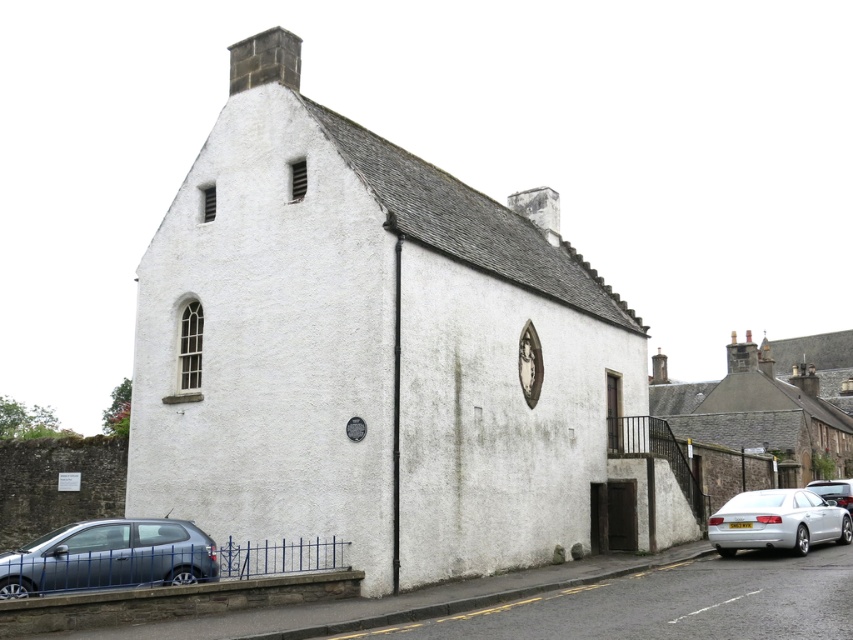
You are standing in front of the building and notice two silver vehicles at the lower right corner. Which one is positioned to the left between the silver metallic sedan at lower right and the silver metallic car at lower right?

The silver metallic sedan at lower right is positioned to the left of the silver metallic car at lower right.

Based on the photo, you are a delivery person trying to park a truck that is 2 meters tall. You see the silver metallic sedan at lower right and the silver metallic car at lower right in the parking area. Which vehicle should you park next to so that your truck can fit between them without hitting the roof?

The silver metallic sedan at lower right has a greater height compared to silver metallic car at lower right. Therefore, you should park the truck next to the silver metallic car at lower lower right since it is shorter, allowing more clearance for the truck.

You are a delivery person driving a van that is 2 meters wide. You need to park your van between the metallic gray hatchback at lower left and the silver metallic sedan at lower right. Is there enough space between them for your van?

The metallic gray hatchback at lower left has a lesser width compared to silver metallic sedan at lower right. However, the total space between them depends on their combined widths and positioning. Since the hatchback is narrower, there might be sufficient space if the distance between them accommodates the van. Without exact measurements, it is uncertain, but the hatchback being smaller could allow for more space. However, the answer should strictly use the given description. Since the description only